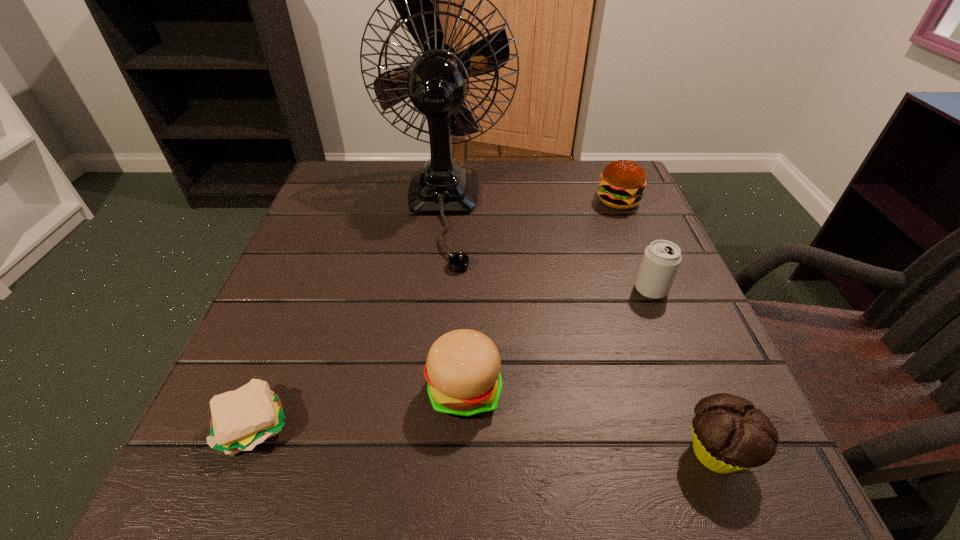
I want to click on the fifth closest object to the right hamburger, so click(x=241, y=419).

Locate an element on the screen. The image size is (960, 540). object that is the closest to the left hamburger is located at coordinates (241, 419).

What are the coordinates of `free space that satisfies the following two spatial constraints: 1. on the front side of the muffin; 2. on the right side of the shortest object` in the screenshot? It's located at (246, 453).

Locate an element on the screen. The image size is (960, 540). vacant region that satisfies the following two spatial constraints: 1. in front of the tallest object, indicating the direction of air flow; 2. on the right side of the muffin is located at coordinates (416, 453).